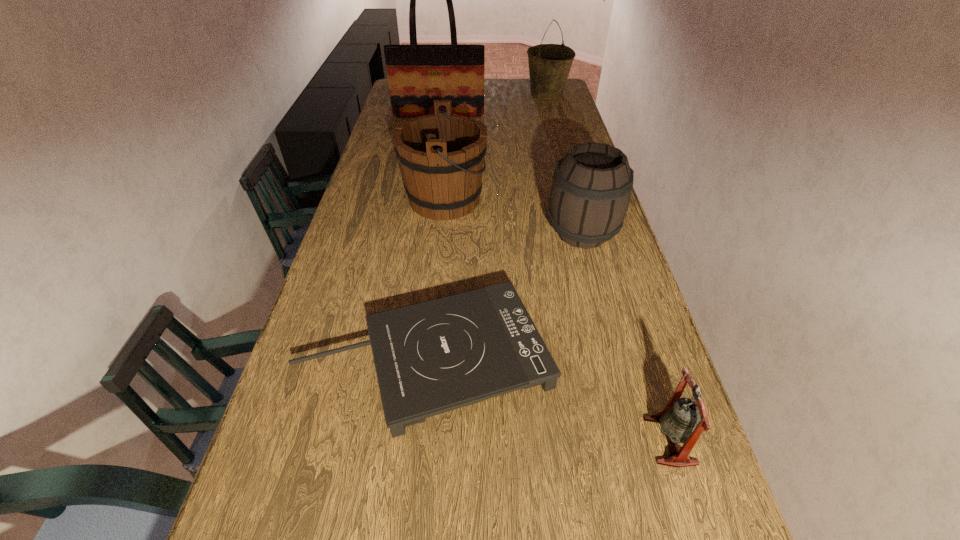
Locate an element on the screen. This screenshot has height=540, width=960. vacant region that satisfies the following two spatial constraints: 1. on the side of the leftmost wine bucket with the handle for carrying; 2. on the front side of the hotplate is located at coordinates (428, 359).

Image resolution: width=960 pixels, height=540 pixels. Identify the location of free space that satisfies the following two spatial constraints: 1. on the back side of the bell; 2. on the side of the leftmost wine bucket with the handle for carrying. (592, 199).

Identify the location of free point that satisfies the following two spatial constraints: 1. on the front-facing side of the second shortest object; 2. on the left side of the fifth nearest object. The height and width of the screenshot is (540, 960). (388, 441).